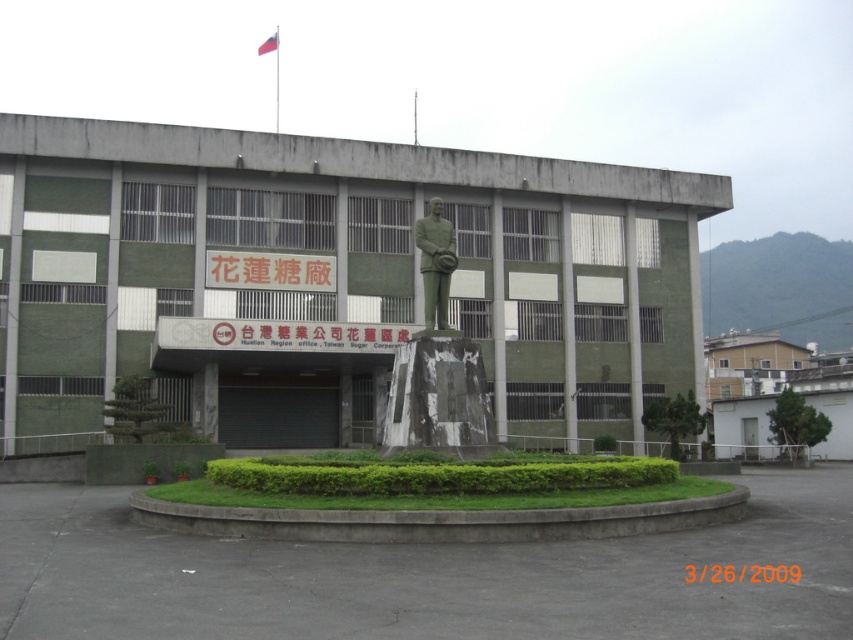
You are standing in front of the industrial building and notice two statues in the landscaped area. Which one is more to the left between the green marble statue at center and the green polished statue at center?

The green marble statue at center is positioned on the left side of the green polished statue at center, so it is more to the left.

You are standing in front of the industrial building and want to take a photo. There are two points marked in the image, point 1 at coordinates point (440, 308) and point 2 at coordinates point (274, 36). Which point will appear larger in your photo?

Point 1 at coordinates point (440, 308) will appear larger in the photo because it is closer to the camera than point 2 at coordinates point (274, 36).